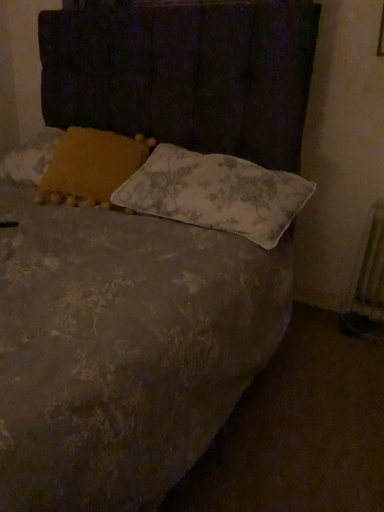
Describe the element at coordinates (370, 269) in the screenshot. The width and height of the screenshot is (384, 512). I see `metallic silver radiator at right` at that location.

I want to click on yellow fabric pillow at upper left, the 1th pillow positioned from the left, so click(x=91, y=166).

I want to click on metallic silver radiator at right, so click(x=370, y=269).

From the image's perspective, is yellow fabric pillow at upper left, the 1th pillow positioned from the left, above or below metallic silver radiator at right?

Based on their image positions, yellow fabric pillow at upper left, the 1th pillow positioned from the left, is located above metallic silver radiator at right.

Which of these two, yellow fabric pillow at upper left, the 2th pillow when ordered from right to left, or metallic silver radiator at right, is thinner?

Thinner between the two is metallic silver radiator at right.

Does yellow fabric pillow at upper left, the 2th pillow when ordered from right to left, turn towards metallic silver radiator at right?

No, yellow fabric pillow at upper left, the 2th pillow when ordered from right to left, does not turn towards metallic silver radiator at right.

Can you see yellow fabric pillow at upper left, the 2th pillow when ordered from right to left, touching metallic silver radiator at right?

yellow fabric pillow at upper left, the 2th pillow when ordered from right to left, is not next to metallic silver radiator at right, and they're not touching.

This screenshot has height=512, width=384. I want to click on pillow behind the floral-patterned fabric pillow at center, which is the 2th pillow from left to right, so click(91, 166).

Is yellow fabric pillow at upper left, the 2th pillow when ordered from right to left, in contact with floral-patterned fabric pillow at center, which appears as the first pillow when viewed from the right?

No.

From the image's perspective, who appears lower, yellow fabric pillow at upper left, the 1th pillow positioned from the left, or floral-patterned fabric pillow at center, which is the 2th pillow from left to right?

floral-patterned fabric pillow at center, which is the 2th pillow from left to right, is shown below in the image.

Is point (83, 149) closer or farther from the camera than point (312, 184)?

Point (83, 149) is positioned closer to the camera compared to point (312, 184).

Is point (286, 193) positioned before point (375, 241)?

Yes, it is.

Is floral-patterned fabric pillow at center, which is the 2th pillow from left to right, far from metallic silver radiator at right?

Actually, floral-patterned fabric pillow at center, which is the 2th pillow from left to right, and metallic silver radiator at right are a little close together.

Which object is wider, floral-patterned fabric pillow at center, which appears as the first pillow when viewed from the right, or metallic silver radiator at right?

With larger width is floral-patterned fabric pillow at center, which appears as the first pillow when viewed from the right.

Is metallic silver radiator at right inside floral-patterned fabric pillow at center, which is the 2th pillow from left to right?

That's incorrect, metallic silver radiator at right is not inside floral-patterned fabric pillow at center, which is the 2th pillow from left to right.

Consider the image. From the image's perspective, between floral-patterned fabric pillow at center, which is the 2th pillow from left to right, and yellow fabric pillow at upper left, the 1th pillow positioned from the left, which one is located above?

yellow fabric pillow at upper left, the 1th pillow positioned from the left, appears higher in the image.

Who is taller, floral-patterned fabric pillow at center, which appears as the first pillow when viewed from the right, or yellow fabric pillow at upper left, the 1th pillow positioned from the left?

yellow fabric pillow at upper left, the 1th pillow positioned from the left, is taller.

From the picture: From a real-world perspective, is floral-patterned fabric pillow at center, which appears as the first pillow when viewed from the right, physically below yellow fabric pillow at upper left, the 1th pillow positioned from the left?

Yes, from a real-world perspective, floral-patterned fabric pillow at center, which appears as the first pillow when viewed from the right, is below yellow fabric pillow at upper left, the 1th pillow positioned from the left.

Which is more to the left, metallic silver radiator at right or yellow fabric pillow at upper left, the 2th pillow when ordered from right to left?

Positioned to the left is yellow fabric pillow at upper left, the 2th pillow when ordered from right to left.

Is metallic silver radiator at right further to the viewer compared to yellow fabric pillow at upper left, the 1th pillow positioned from the left?

Yes, metallic silver radiator at right is further from the viewer.

The image size is (384, 512). Identify the location of radiator that appears behind the yellow fabric pillow at upper left, the 1th pillow positioned from the left. (370, 269).

Which point is more forward, (383, 277) or (152, 188)?

The point (152, 188) is in front.

From a real-world perspective, which object stands above the other?

floral-patterned fabric pillow at center, which appears as the first pillow when viewed from the right, is physically above.

Who is bigger, metallic silver radiator at right or floral-patterned fabric pillow at center, which is the 2th pillow from left to right?

With larger size is floral-patterned fabric pillow at center, which is the 2th pillow from left to right.

How many degrees apart are the facing directions of metallic silver radiator at right and floral-patterned fabric pillow at center, which appears as the first pillow when viewed from the right?

The facing directions of metallic silver radiator at right and floral-patterned fabric pillow at center, which appears as the first pillow when viewed from the right, are 0.363 degrees apart.

This screenshot has height=512, width=384. Find the location of `pillow that is the 1st one when counting forward from the metallic silver radiator at right`. pillow that is the 1st one when counting forward from the metallic silver radiator at right is located at coordinates (91, 166).

The width and height of the screenshot is (384, 512). There is a floral-patterned fabric pillow at center, which is the 2th pillow from left to right. In order to click on pillow above it (from a real-world perspective) in this screenshot , I will do `click(91, 166)`.

Based on their spatial positions, is metallic silver radiator at right or floral-patterned fabric pillow at center, which appears as the first pillow when viewed from the right, further from yellow fabric pillow at upper left, the 1th pillow positioned from the left?

The object further to yellow fabric pillow at upper left, the 1th pillow positioned from the left, is metallic silver radiator at right.

When comparing their distances from floral-patterned fabric pillow at center, which is the 2th pillow from left to right, does metallic silver radiator at right or yellow fabric pillow at upper left, the 1th pillow positioned from the left, seem further?

Among the two, metallic silver radiator at right is located further to floral-patterned fabric pillow at center, which is the 2th pillow from left to right.

Estimate the real-world distances between objects in this image. Which object is closer to floral-patterned fabric pillow at center, which is the 2th pillow from left to right, yellow fabric pillow at upper left, the 1th pillow positioned from the left, or metallic silver radiator at right?

The object closer to floral-patterned fabric pillow at center, which is the 2th pillow from left to right, is yellow fabric pillow at upper left, the 1th pillow positioned from the left.

From the image, which object appears to be farther from yellow fabric pillow at upper left, the 1th pillow positioned from the left, floral-patterned fabric pillow at center, which is the 2th pillow from left to right, or metallic silver radiator at right?

The object further to yellow fabric pillow at upper left, the 1th pillow positioned from the left, is metallic silver radiator at right.

From the image, which object appears to be nearer to metallic silver radiator at right, yellow fabric pillow at upper left, the 1th pillow positioned from the left, or floral-patterned fabric pillow at center, which appears as the first pillow when viewed from the right?

floral-patterned fabric pillow at center, which appears as the first pillow when viewed from the right.

From the picture: Which object lies nearer to the anchor point metallic silver radiator at right, floral-patterned fabric pillow at center, which appears as the first pillow when viewed from the right, or yellow fabric pillow at upper left, the 1th pillow positioned from the left?

Among the two, floral-patterned fabric pillow at center, which appears as the first pillow when viewed from the right, is located nearer to metallic silver radiator at right.

Identify the location of pillow between yellow fabric pillow at upper left, the 2th pillow when ordered from right to left, and metallic silver radiator at right. The width and height of the screenshot is (384, 512). (216, 193).